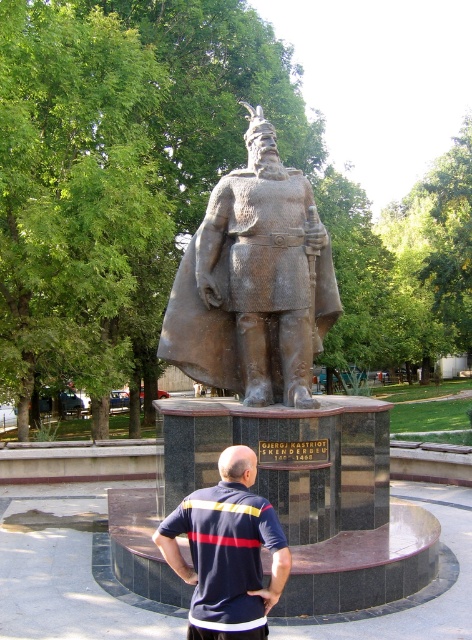
Question: Considering the relative positions of bronze statue at center and dark blue shirt at center in the image provided, where is bronze statue at center located with respect to dark blue shirt at center?

Choices:
 (A) above
 (B) below

Answer: (A)

Question: Can you confirm if bronze statue at center is thinner than dark blue shirt at center?

Choices:
 (A) yes
 (B) no

Answer: (B)

Question: Which of the following is the closest to the observer?

Choices:
 (A) dark blue shirt at center
 (B) bronze statue at center

Answer: (A)

Question: Is bronze statue at center to the right of dark blue shirt at center from the viewer's perspective?

Choices:
 (A) no
 (B) yes

Answer: (B)